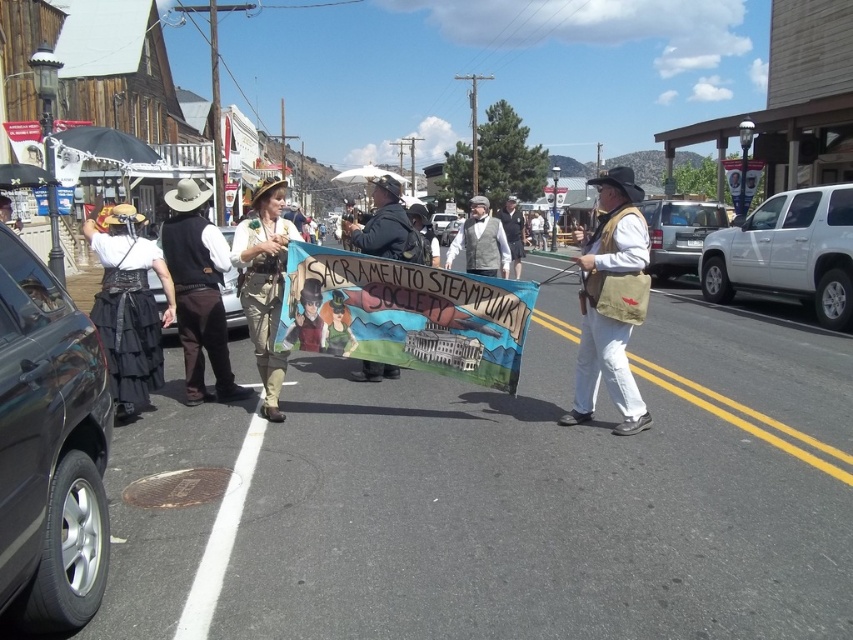
Question: Which object is farther from the camera taking this photo?

Choices:
 (A) brown leather vest at center
 (B) light brown leather bag at center
 (C) matte black sign at center
 (D) light brown leather jacket at center

Answer: (D)

Question: Where is light brown leather bag at center located in relation to matte black sign at center in the image?

Choices:
 (A) left
 (B) right

Answer: (B)

Question: Which object appears farthest from the camera in this image?

Choices:
 (A) light brown leather jacket at center
 (B) brown leather vest at center

Answer: (A)

Question: Is light brown leather bag at center closer to camera compared to light brown leather jacket at center?

Choices:
 (A) no
 (B) yes

Answer: (B)

Question: Does brown leather vest at center appear on the left side of light brown leather jacket at center?

Choices:
 (A) no
 (B) yes

Answer: (B)

Question: Based on their relative distances, which object is nearer to the light brown leather jacket at center?

Choices:
 (A) matte black sign at center
 (B) brown leather vest at center
 (C) light brown leather bag at center

Answer: (C)